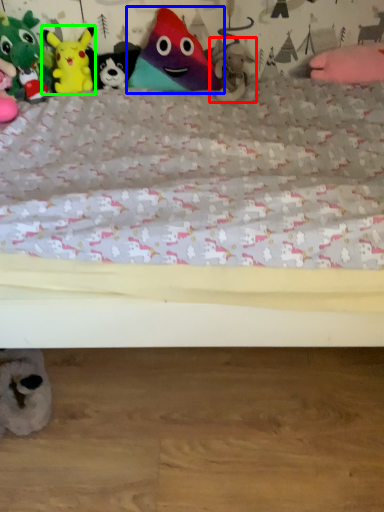
Question: Which object is positioned farthest from toy (highlighted by a red box)? Select from toy (highlighted by a blue box) and toy (highlighted by a green box).

Choices:
 (A) toy
 (B) toy

Answer: (B)